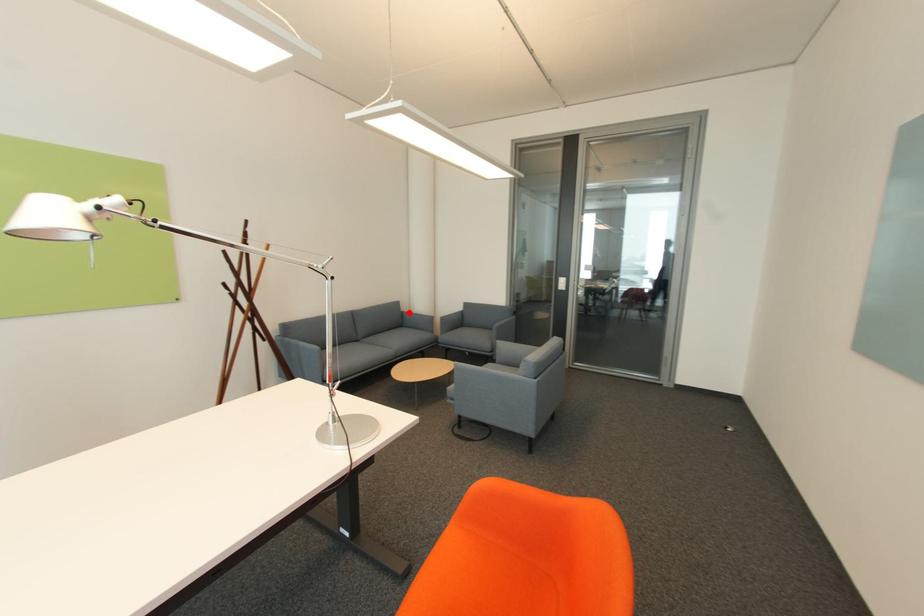
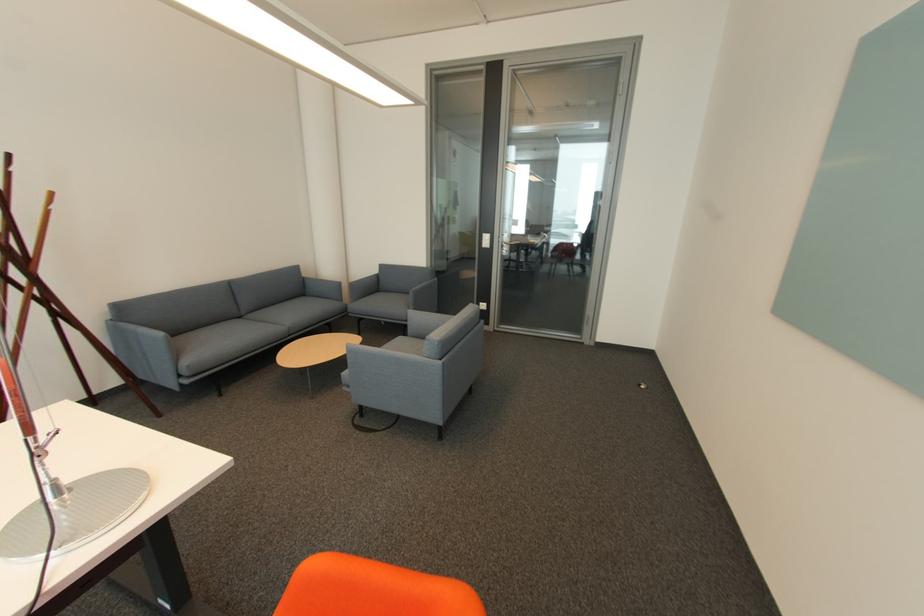
The point at the highlighted location is marked in the first image. Where is the corresponding point in the second image?

(310, 278)